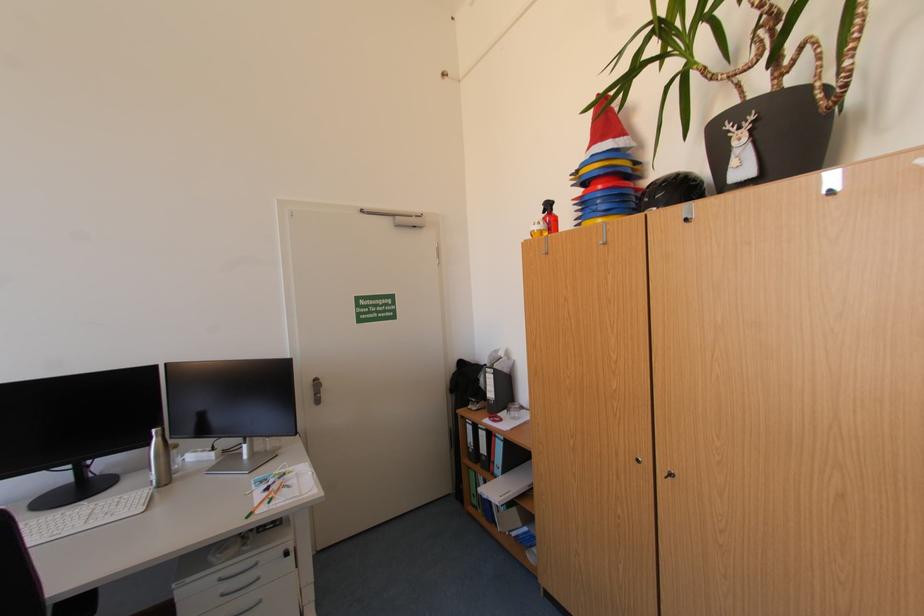
Where would you squeez the red spray trigger? Please return your answer as a coordinate pair (x, y).

(551, 222)